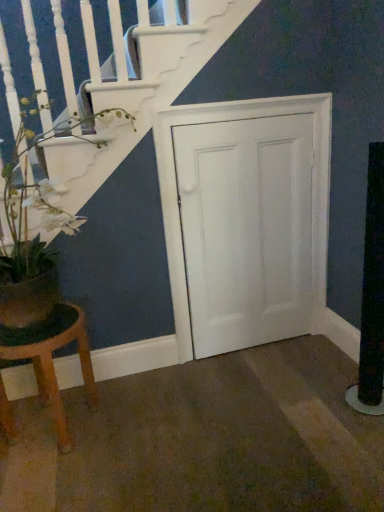
This screenshot has height=512, width=384. Find the location of `free space in front of white wood door at center`. free space in front of white wood door at center is located at coordinates click(x=265, y=390).